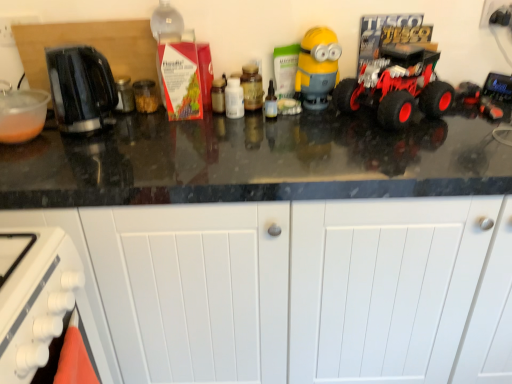
Question: Can you confirm if rubberized red truck at right is thinner than transparent glass bottle at center, acting as the 3th bottle starting from the left?

Choices:
 (A) yes
 (B) no

Answer: (B)

Question: Could you tell me if rubberized red truck at right is turned towards transparent glass bottle at center, arranged as the 1th bottle when viewed from the right?

Choices:
 (A) yes
 (B) no

Answer: (B)

Question: Is rubberized red truck at right to the right of transparent glass bottle at center, acting as the 3th bottle starting from the left, from the viewer's perspective?

Choices:
 (A) no
 (B) yes

Answer: (B)

Question: Is rubberized red truck at right positioned far away from transparent glass bottle at center, acting as the 3th bottle starting from the left?

Choices:
 (A) yes
 (B) no

Answer: (B)

Question: Does rubberized red truck at right contain transparent glass bottle at center, arranged as the 1th bottle when viewed from the right?

Choices:
 (A) yes
 (B) no

Answer: (B)

Question: Considering the relative positions of yellow matte minion at center and white plastic bottle at center, marked as the 1th bottle in a left-to-right arrangement, in the image provided, is yellow matte minion at center to the left or to the right of white plastic bottle at center, marked as the 1th bottle in a left-to-right arrangement,?

Choices:
 (A) right
 (B) left

Answer: (A)

Question: Is point (306, 92) closer or farther from the camera than point (237, 102)?

Choices:
 (A) closer
 (B) farther

Answer: (B)

Question: Is yellow matte minion at center inside the boundaries of white plastic bottle at center, placed as the 3th bottle when sorted from right to left, or outside?

Choices:
 (A) outside
 (B) inside

Answer: (A)

Question: In terms of width, does yellow matte minion at center look wider or thinner when compared to white plastic bottle at center, placed as the 3th bottle when sorted from right to left?

Choices:
 (A) wide
 (B) thin

Answer: (A)

Question: From the image's perspective, relative to white matte cabinet at lower center, is rubberized red truck at right above or below?

Choices:
 (A) above
 (B) below

Answer: (A)

Question: Is rubberized red truck at right inside the boundaries of white matte cabinet at lower center, or outside?

Choices:
 (A) outside
 (B) inside

Answer: (A)

Question: Based on their positions, is rubberized red truck at right located to the left or right of white matte cabinet at lower center?

Choices:
 (A) right
 (B) left

Answer: (A)

Question: In terms of width, does rubberized red truck at right look wider or thinner when compared to white matte cabinet at lower center?

Choices:
 (A) wide
 (B) thin

Answer: (B)

Question: Considering the positions of point (247, 104) and point (389, 76), is point (247, 104) closer or farther from the camera than point (389, 76)?

Choices:
 (A) farther
 (B) closer

Answer: (A)

Question: Is matte brown jar at center, placed as the 2th bottle when sorted from left to right, wider or thinner than rubberized red truck at right?

Choices:
 (A) wide
 (B) thin

Answer: (B)